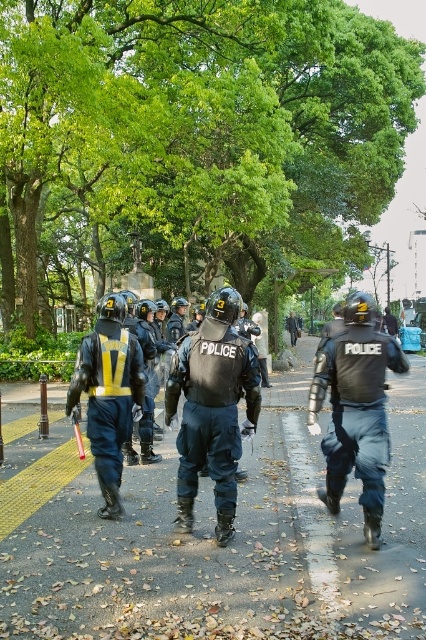
You are a delivery drone flying above the scene. You need to land on the smooth asphalt road at center. Based on the coordinates provided, can you determine if the point marked at (227, 547) is a suitable landing spot?

The point marked at (227, 547) corresponds to the smooth asphalt road at center, which is a suitable landing spot for the delivery drone.

Based on the photo, you are a photographer trying to capture a clear shot of the matte black vest at center and the matte black police uniform at center. Since the pathway is narrow, you need to know which one is narrower to frame your shot properly. Which object has a smaller width?

The matte black vest at center has a lesser width compared to the matte black police uniform at center, so it is narrower and would be easier to frame in a narrow pathway.

You are a photographer trying to capture a clear shot of the smooth asphalt road at center and the matte black police uniform at center. Since you want to focus on the road, which object should you adjust your camera to focus on first, considering their heights?

The smooth asphalt road at center has a lesser height compared to the matte black police uniform at center. Therefore, you should focus on the smooth asphalt road at center first as it is lower and closer to the ground level.